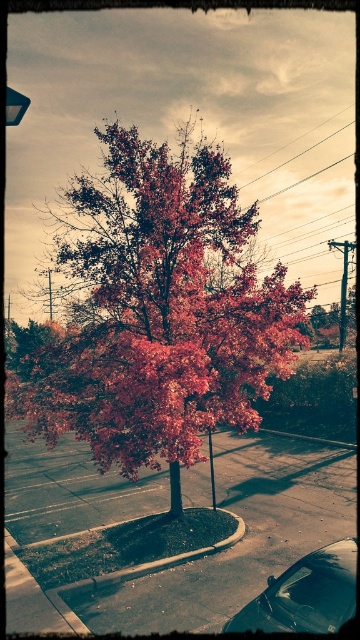
Based on the photo, who is shorter, shiny red maple tree at center or shiny black car at lower right?

With less height is shiny black car at lower right.

Can you confirm if shiny red maple tree at center is taller than shiny black car at lower right?

Correct, shiny red maple tree at center is much taller as shiny black car at lower right.

Which is behind, point (84, 397) or point (308, 598)?

The point (84, 397) is more distant.

What are the coordinates of `shiny red maple tree at center` in the screenshot? It's located at (159, 310).